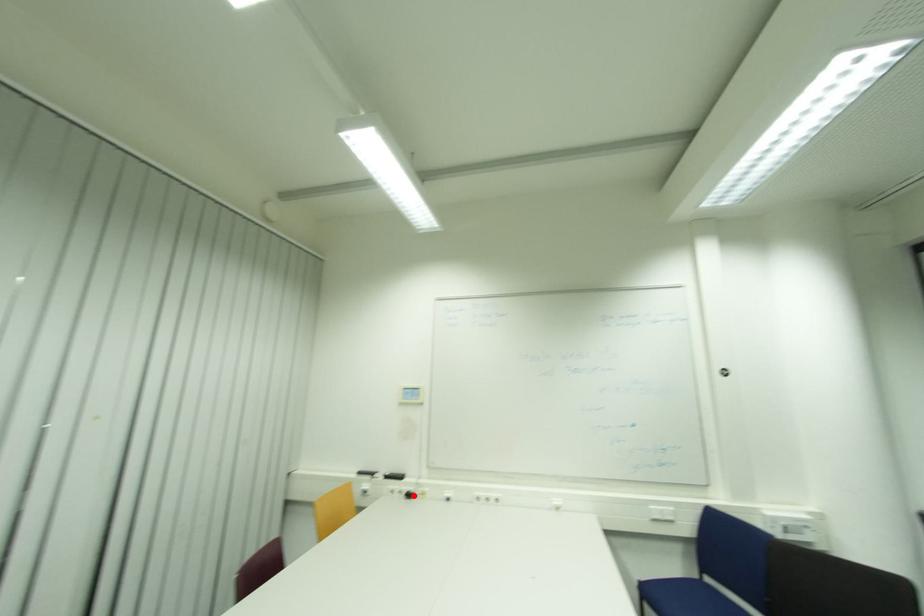
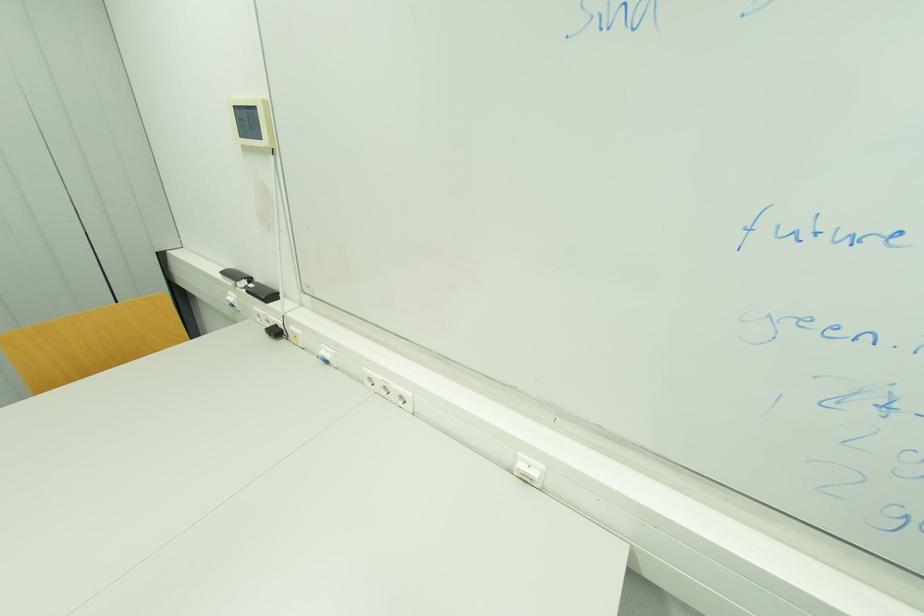
Locate, in the second image, the point that corresponds to the highlighted location in the first image.

(281, 333)